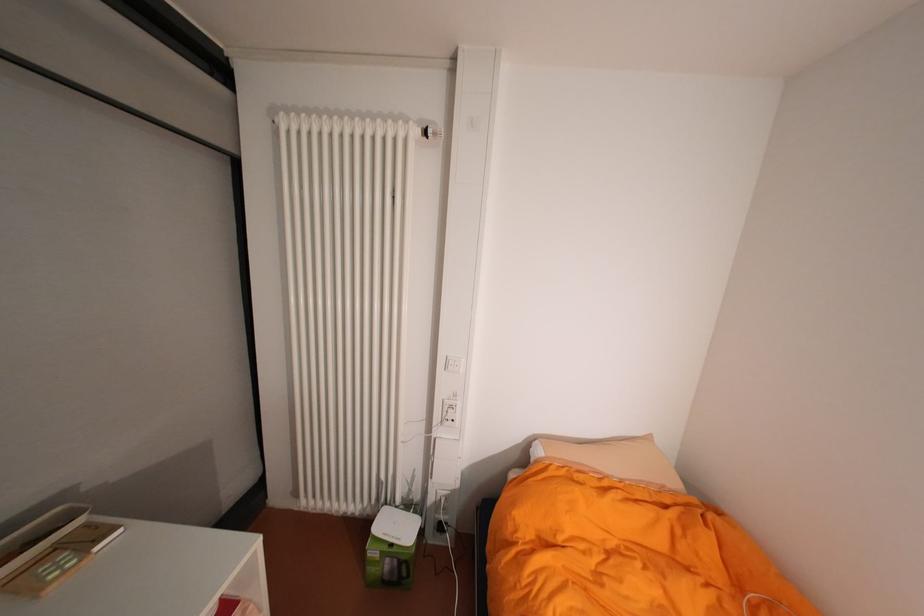
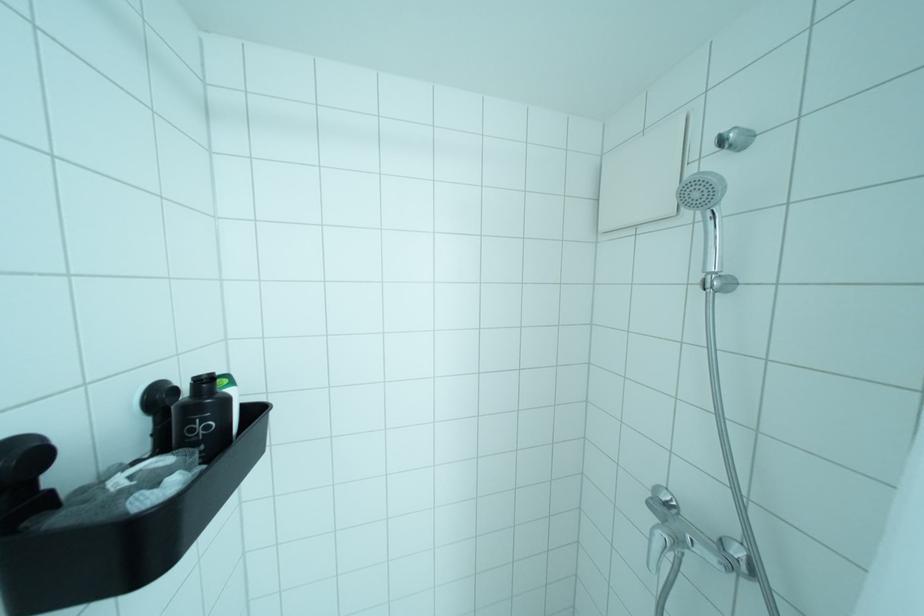
Question: What movement of the cameraman would produce the second image?

Choices:
 (A) Left
 (B) Right
 (C) Forward
 (D) Backward

Answer: (B)